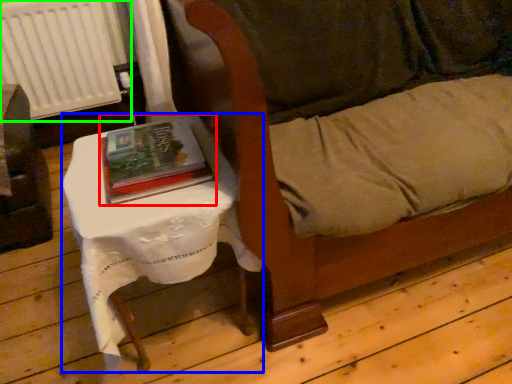
Question: Based on their relative distances, which object is nearer to book (highlighted by a red box)? Choose from table (highlighted by a blue box) and radiator (highlighted by a green box).

Choices:
 (A) table
 (B) radiator

Answer: (A)